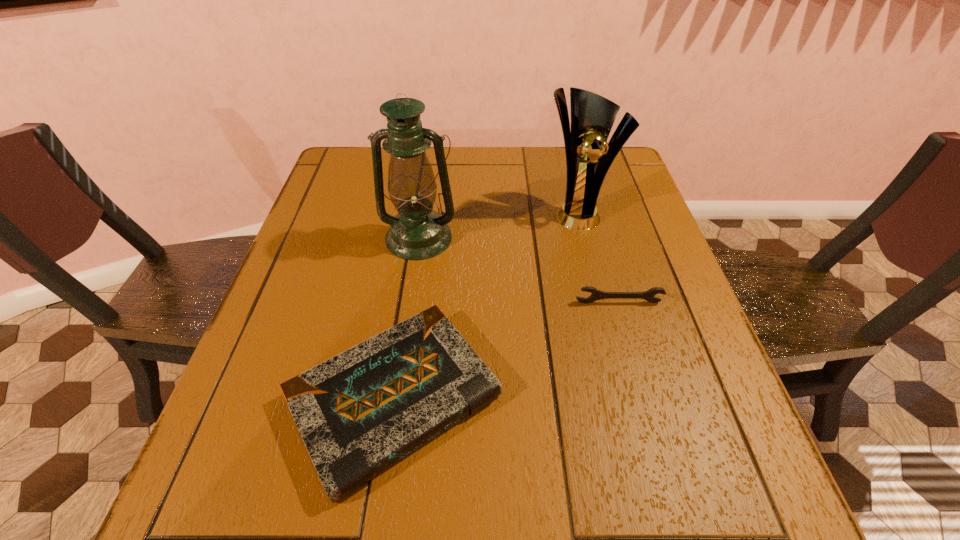
Identify which object is the third closest to the third farthest object. Please provide its 2D coordinates. Your answer should be formatted as a tuple, i.e. [(x, y)], where the tuple contains the x and y coordinates of a point satisfying the conditions above.

[(417, 232)]